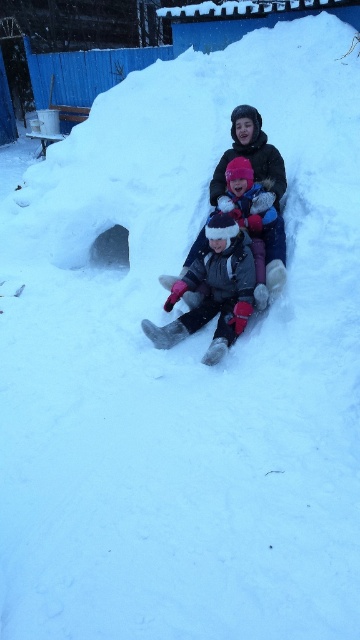
Does point (213, 230) come behind point (209, 218)?

No.

Is gray woolen hat at center closer to the viewer compared to fluffy pink hat at center?

That is True.

Find the location of a particular element. The image size is (360, 640). gray woolen hat at center is located at coordinates (213, 291).